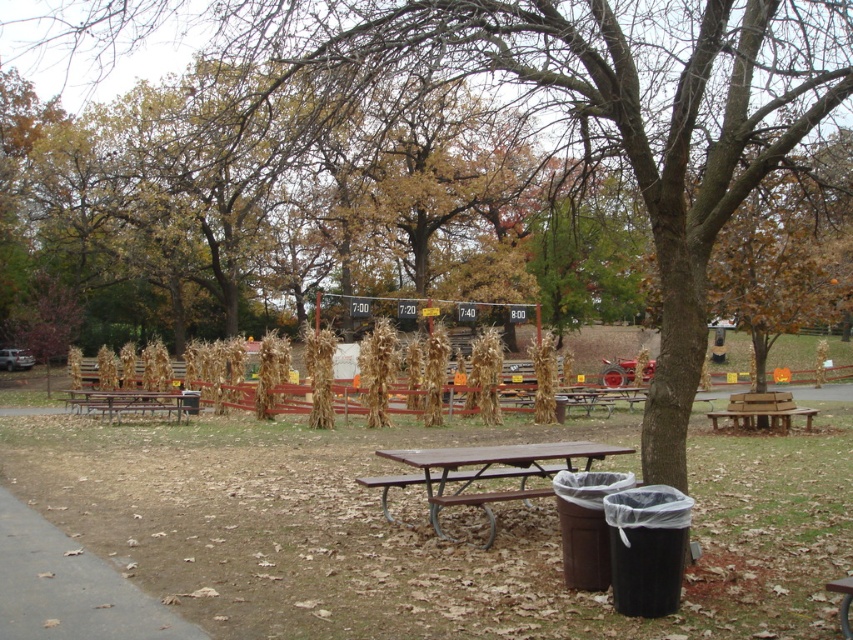
Question: In this image, where is brown metal picnic table at center located relative to brown wooden picnic table at lower left?

Choices:
 (A) above
 (B) below

Answer: (B)

Question: Which point is farther from the camera taking this photo?

Choices:
 (A) (190, 408)
 (B) (593, 456)

Answer: (A)

Question: Can you confirm if brown metal picnic table at center is wider than brown wooden picnic table at lower left?

Choices:
 (A) no
 (B) yes

Answer: (B)

Question: Among these objects, which one is farthest from the camera?

Choices:
 (A) brown wooden picnic table at lower left
 (B) brown metal picnic table at center

Answer: (A)

Question: Observing the image, what is the correct spatial positioning of brown metal picnic table at center in reference to brown wooden picnic table at lower left?

Choices:
 (A) right
 (B) left

Answer: (A)